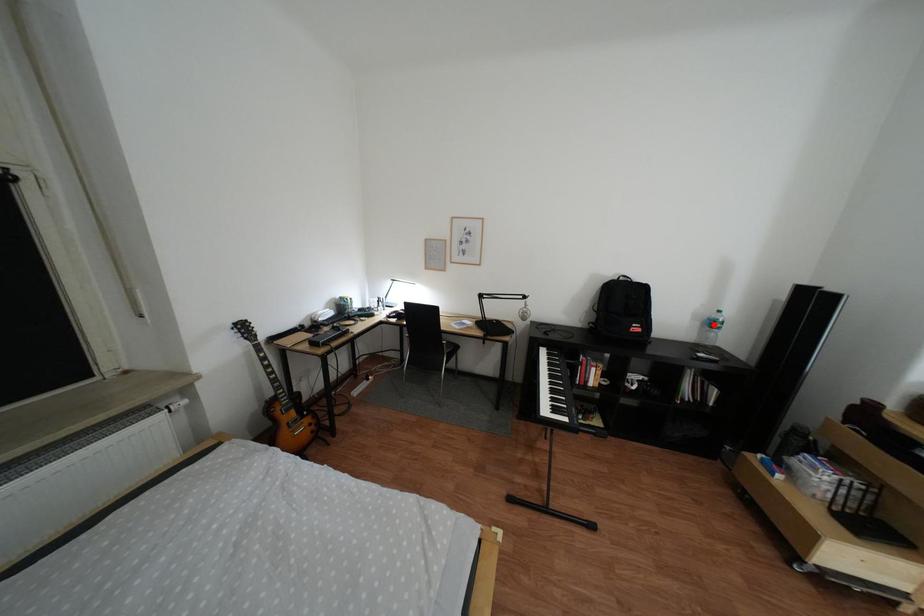
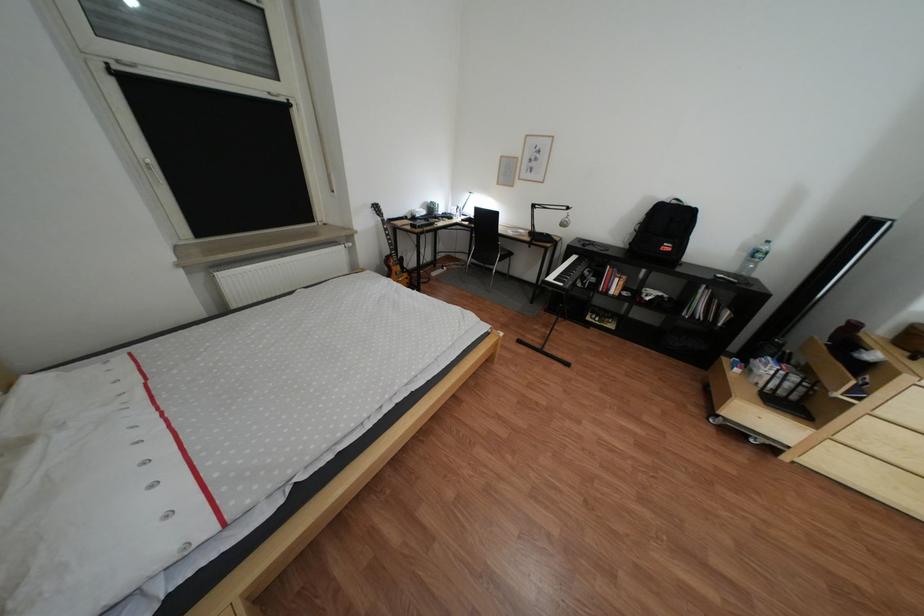
In the second image, find the point that corresponds to the highlighted location in the first image.

(760, 256)